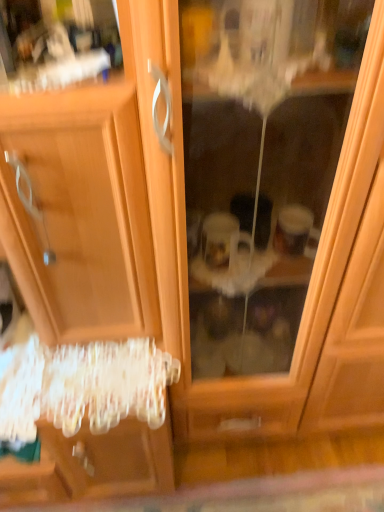
Question: Relative to wooden dresser at left, is transparent plastic screen door at left in front or behind?

Choices:
 (A) front
 (B) behind

Answer: (B)

Question: Looking at the image, does transparent plastic screen door at left seem bigger or smaller compared to wooden dresser at left?

Choices:
 (A) big
 (B) small

Answer: (B)

Question: Considering the positions of transparent plastic screen door at left and wooden dresser at left in the image, is transparent plastic screen door at left taller or shorter than wooden dresser at left?

Choices:
 (A) short
 (B) tall

Answer: (A)

Question: From the image's perspective, is wooden dresser at left above or below transparent plastic screen door at left?

Choices:
 (A) below
 (B) above

Answer: (A)

Question: Do you think wooden dresser at left is within transparent plastic screen door at left, or outside of it?

Choices:
 (A) inside
 (B) outside

Answer: (B)

Question: Relative to transparent plastic screen door at left, is wooden dresser at left in front or behind?

Choices:
 (A) behind
 (B) front

Answer: (B)

Question: Does point (91, 485) appear closer or farther from the camera than point (322, 233)?

Choices:
 (A) farther
 (B) closer

Answer: (A)